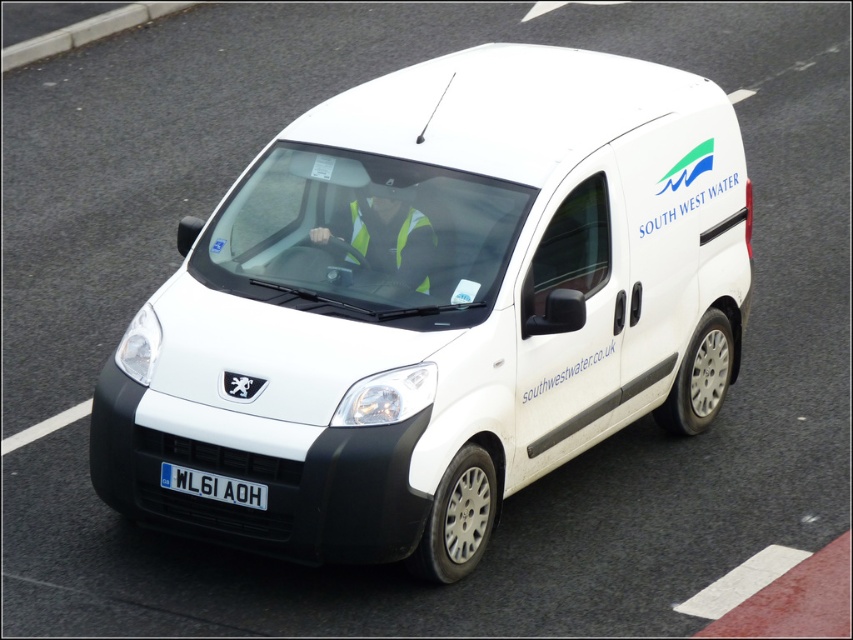
Question: Does white matte van at center have a larger size compared to white plastic license plate at center?

Choices:
 (A) no
 (B) yes

Answer: (B)

Question: Which object is the closest to the white plastic license plate at center?

Choices:
 (A) white matte van at center
 (B) reflective yellow vest at center

Answer: (A)

Question: Is white matte van at center smaller than reflective yellow vest at center?

Choices:
 (A) yes
 (B) no

Answer: (B)

Question: Which of the following is the closest to the observer?

Choices:
 (A) white plastic license plate at center
 (B) white matte van at center

Answer: (B)

Question: Does white matte van at center come in front of white plastic license plate at center?

Choices:
 (A) no
 (B) yes

Answer: (B)

Question: Based on their relative distances, which object is farther from the white plastic license plate at center?

Choices:
 (A) reflective yellow vest at center
 (B) white matte van at center

Answer: (A)